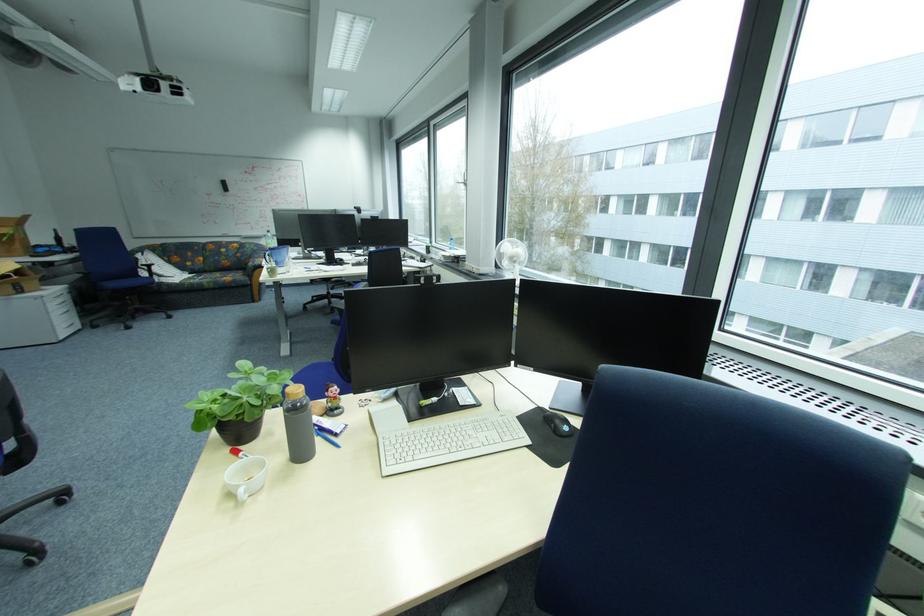
The location [557,424] corresponds to which object?

This point indicates the computer mouse.